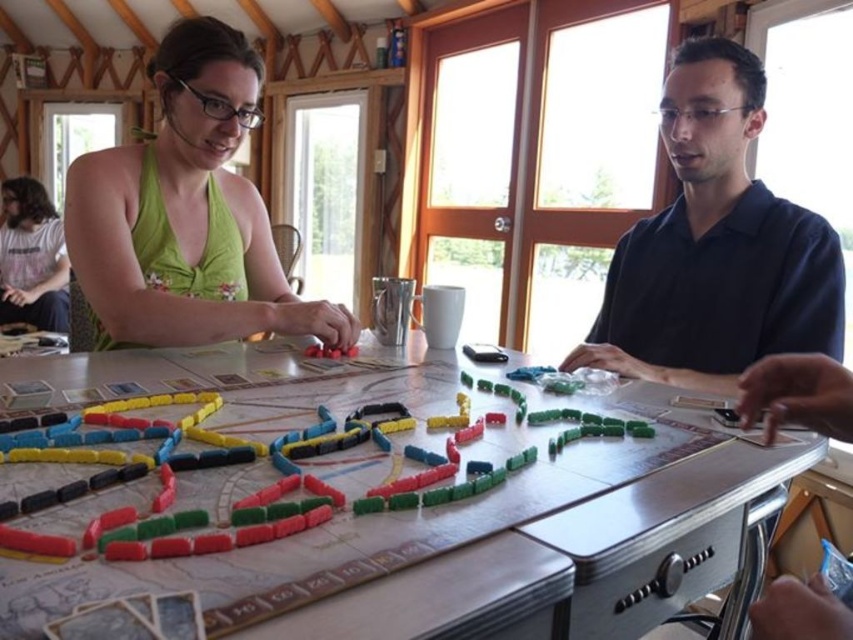
You are arranging a small party and need to place a 1.2 meter long banner on the wooden table at center. Considering the green fabric dress at left is currently occupying space on the table, can the banner fit horizontally across the table?

The wooden table at center might be wider than green fabric dress at left, so it is possible the banner could fit, but the exact width isn